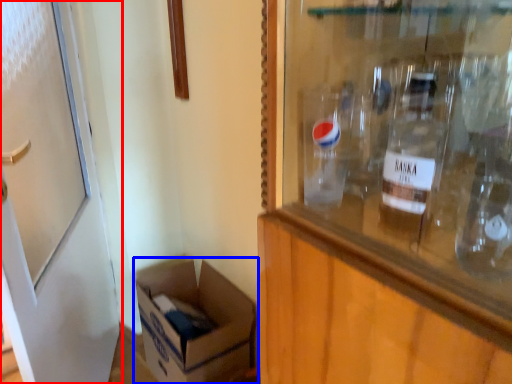
Question: Which point is further to the camera, door (highlighted by a red box) or box (highlighted by a blue box)?

Choices:
 (A) door
 (B) box

Answer: (B)